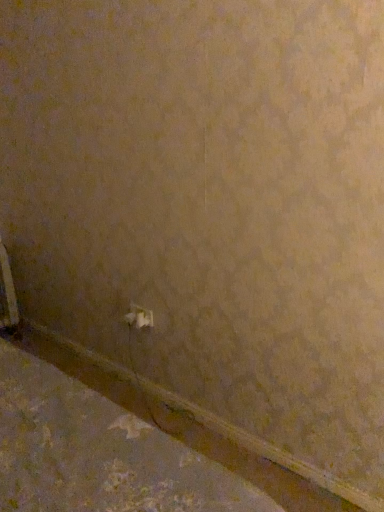
Question: Can you confirm if white plastic radiator at lower left is thinner than white plastic power plug at center?

Choices:
 (A) no
 (B) yes

Answer: (A)

Question: Is white plastic radiator at lower left not close to white plastic power plug at center?

Choices:
 (A) yes
 (B) no

Answer: (A)

Question: From a real-world perspective, is white plastic radiator at lower left under white plastic power plug at center?

Choices:
 (A) yes
 (B) no

Answer: (A)

Question: Is white plastic radiator at lower left completely or partially outside of white plastic power plug at center?

Choices:
 (A) yes
 (B) no

Answer: (A)

Question: Does white plastic radiator at lower left appear on the left side of white plastic power plug at center?

Choices:
 (A) yes
 (B) no

Answer: (A)

Question: Could you tell me if white plastic radiator at lower left is facing white plastic power plug at center?

Choices:
 (A) no
 (B) yes

Answer: (B)

Question: Can you confirm if brown matte concrete at lower left is thinner than white plastic radiator at lower left?

Choices:
 (A) no
 (B) yes

Answer: (B)

Question: From the image's perspective, is brown matte concrete at lower left under white plastic radiator at lower left?

Choices:
 (A) no
 (B) yes

Answer: (B)

Question: Does brown matte concrete at lower left have a smaller size compared to white plastic radiator at lower left?

Choices:
 (A) yes
 (B) no

Answer: (A)

Question: From a real-world perspective, is brown matte concrete at lower left under white plastic radiator at lower left?

Choices:
 (A) yes
 (B) no

Answer: (A)

Question: Is white plastic radiator at lower left inside brown matte concrete at lower left?

Choices:
 (A) yes
 (B) no

Answer: (B)

Question: Does brown matte concrete at lower left turn towards white plastic radiator at lower left?

Choices:
 (A) no
 (B) yes

Answer: (A)

Question: Is there a large distance between brown matte concrete at lower left and white plastic power plug at center?

Choices:
 (A) no
 (B) yes

Answer: (A)